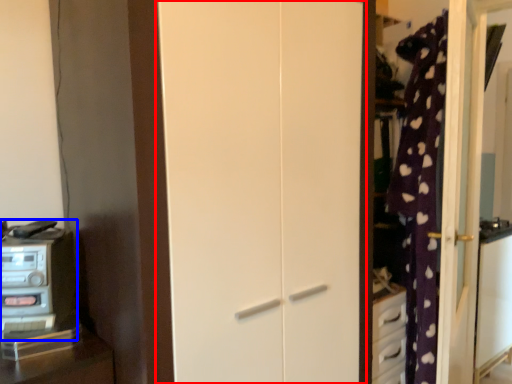
Question: Which of the following is the farthest to the observer, door (highlighted by a red box) or appliance (highlighted by a blue box)?

Choices:
 (A) door
 (B) appliance

Answer: (B)